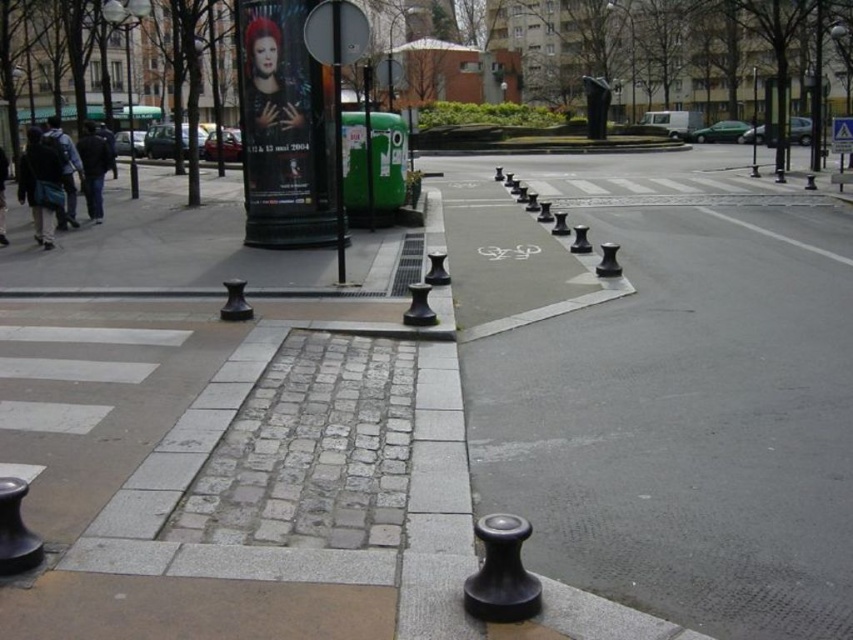
Who is positioned more to the left, black rubber bollards at center or metallic pole at center?

metallic pole at center

Can you confirm if black rubber bollards at center is taller than metallic pole at center?

Correct, black rubber bollards at center is much taller as metallic pole at center.

Is point (724, 394) behind point (337, 118)?

No.

Locate an element on the screen. The width and height of the screenshot is (853, 640). black rubber bollards at center is located at coordinates (666, 390).